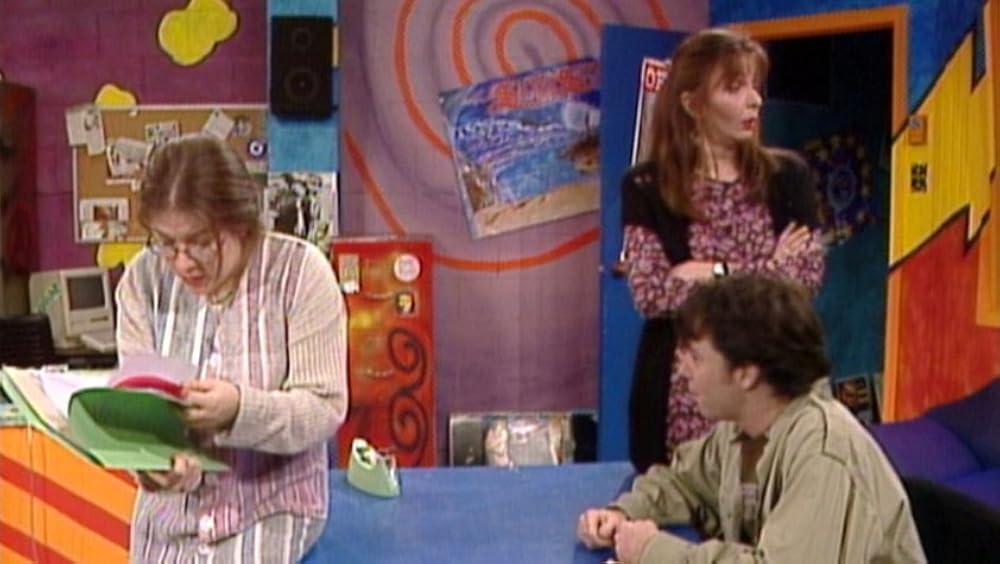
Image resolution: width=1000 pixels, height=564 pixels. In order to click on folder in this screenshot , I will do `click(110, 430)`.